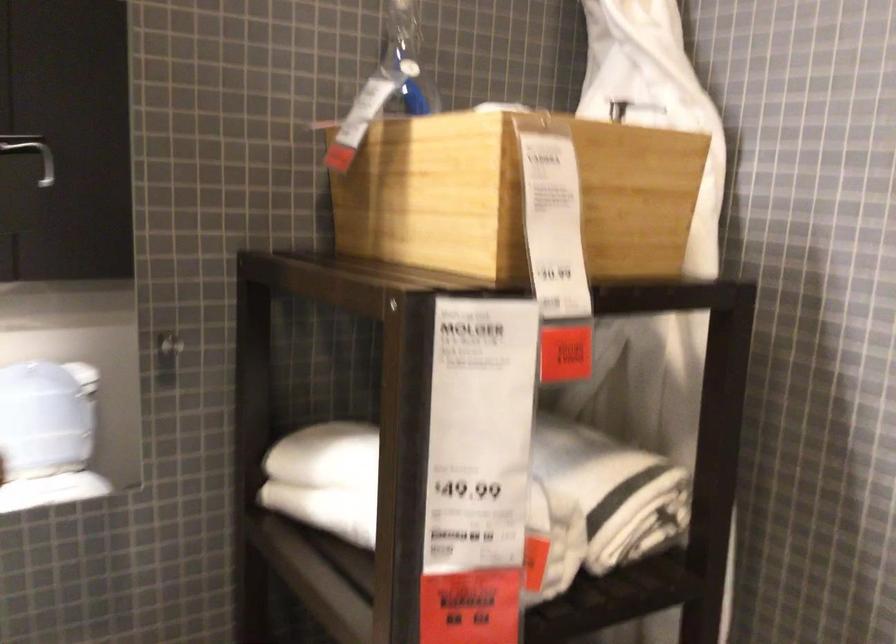
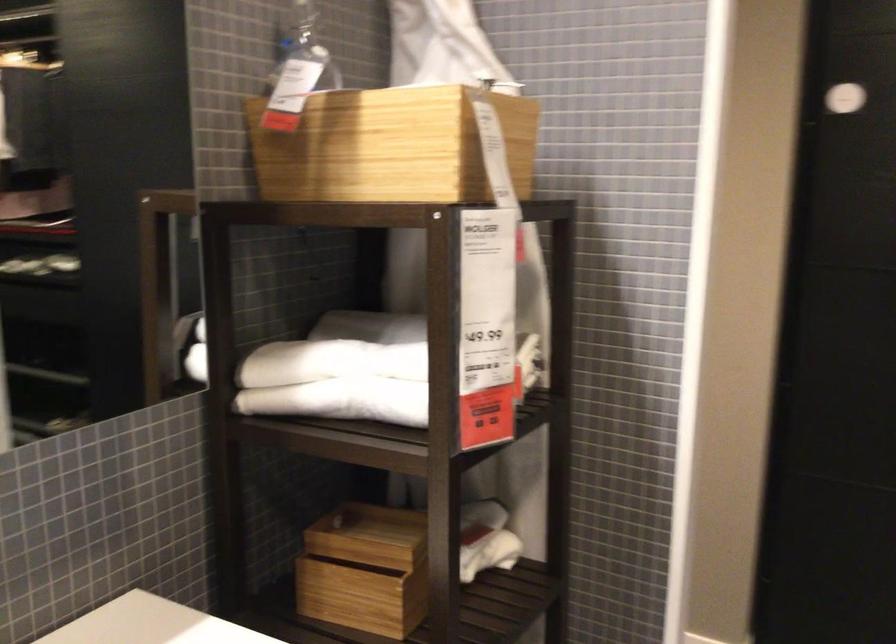
Locate, in the second image, the point that corresponds to [362,114] in the first image.

(297, 91)